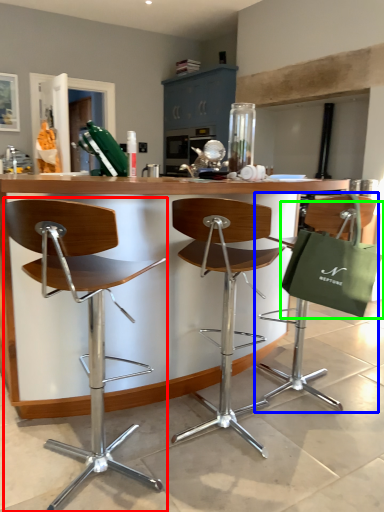
Question: Which object is the closest to the chair (highlighted by a red box)? Choose among these: chair (highlighted by a blue box) or shopping bag (highlighted by a green box).

Choices:
 (A) chair
 (B) shopping bag

Answer: (B)